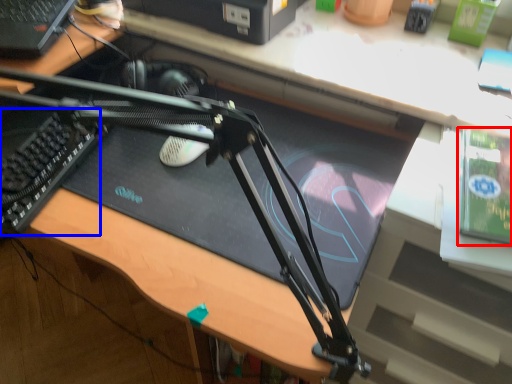
Question: Among these objects, which one is farthest to the camera, paperback book (highlighted by a red box) or laptop keyboard (highlighted by a blue box)?

Choices:
 (A) paperback book
 (B) laptop keyboard

Answer: (B)